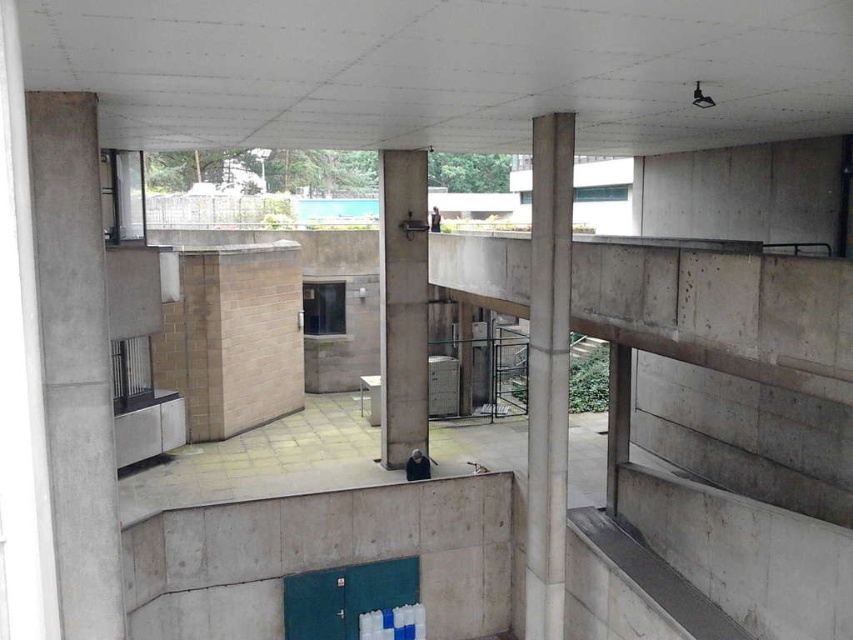
You are navigating through this modern architectural space and need to reach a specific location. You see two points marked as point (45, 173) and point (392, 259). Which point is closer to your current position if you are standing at the origin?

Point (45, 173) is closer to the origin since it has smaller coordinates in both x and y axes compared to point (392, 259).

You are standing in the modern architectural space and want to reach the green door with blue markings. The concrete at left is an obstacle in your path. Can you walk around it? Please explain.

The concrete at left is 25.41 feet away from you, so you can walk around it to reach the green door with blue markings.